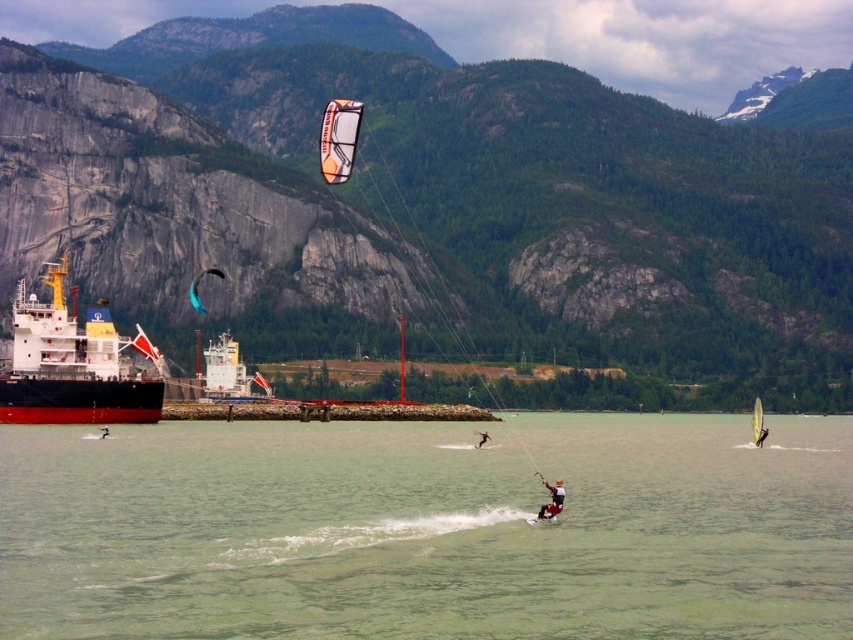
Question: Among these objects, which one is farthest from the camera?

Choices:
 (A) white fabric sail at center
 (B) black matte wetsuit at center
 (C) red matte ship at left
 (D) translucent orange kite at center

Answer: (A)

Question: Does green water at center appear over red matte ship at left?

Choices:
 (A) yes
 (B) no

Answer: (B)

Question: Is red matte ship at left to the left of teal fabric parachute at center from the viewer's perspective?

Choices:
 (A) no
 (B) yes

Answer: (B)

Question: Which object is the closest to the red matte ship at left?

Choices:
 (A) white fabric sail at center
 (B) gray rock mountain at upper left
 (C) black matte wetsuit at center
 (D) translucent orange kite at center

Answer: (D)

Question: Which point is farther to the camera?

Choices:
 (A) red matte ship at left
 (B) white fabric sail at center
 (C) gray rock mountain at upper left

Answer: (C)

Question: Is gray rock mountain at upper left above green water at center?

Choices:
 (A) yes
 (B) no

Answer: (A)